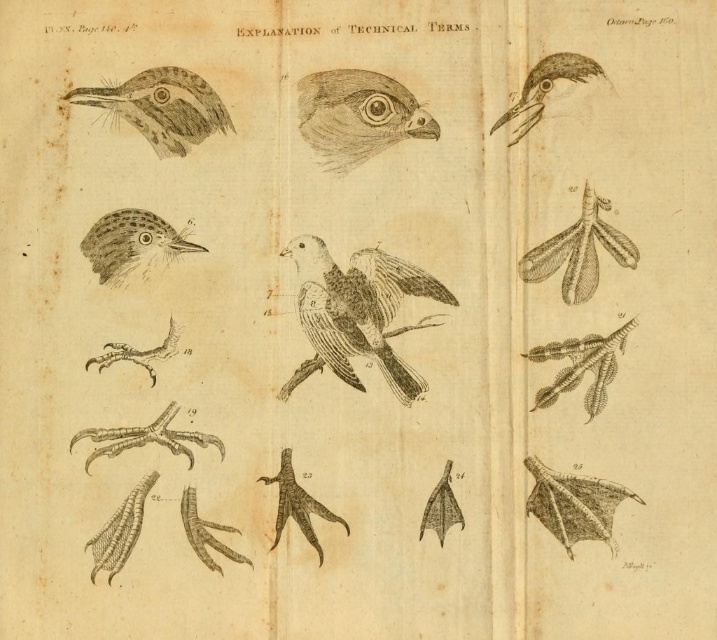
You are a student studying bird anatomy. You have to compare the position of the brown speckled bird at center and the etched paper bird head at center in the image. Which one is located to the right?

The etched paper bird head at center is located to the right of the brown speckled bird at center.

Based on the scene description, where is the brown speckled bird at center located in the image?

The brown speckled bird at center is located at point (x=356, y=312).